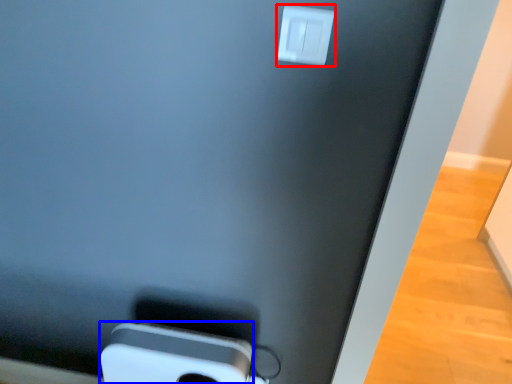
Question: Which of the following is the farthest to the observer, power plugs and sockets (highlighted by a red box) or ipod (highlighted by a blue box)?

Choices:
 (A) power plugs and sockets
 (B) ipod

Answer: (B)